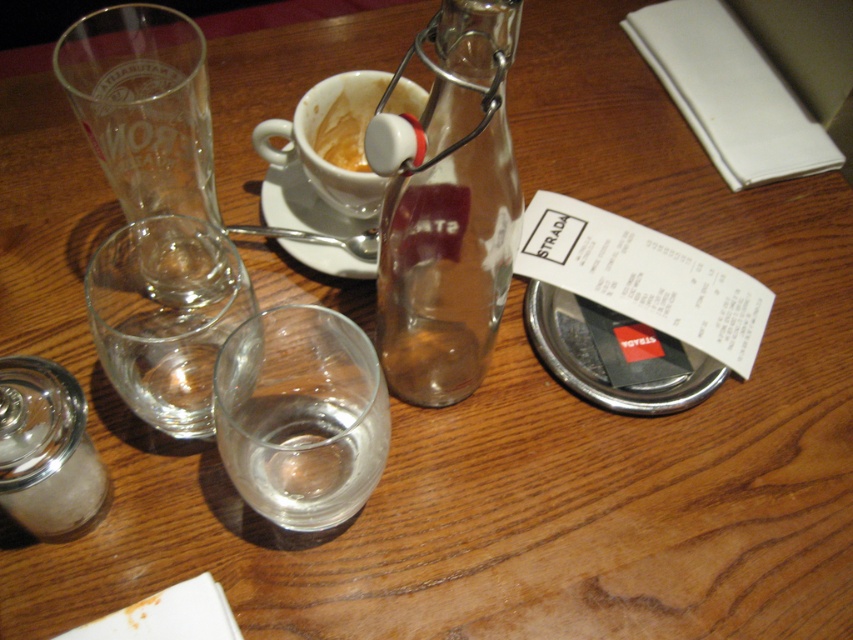
Question: Which object is closer to the camera taking this photo?

Choices:
 (A) white ceramic saucer at upper center
 (B) matte white cup at upper center

Answer: (B)

Question: Which point is closer to the camera taking this photo?

Choices:
 (A) coord(347,266)
 (B) coord(479,144)
 (C) coord(338,132)

Answer: (B)

Question: Which point is closer to the camera?

Choices:
 (A) white ceramic cup at upper center
 (B) white ceramic saucer at upper center

Answer: (A)

Question: Does transparent glass bottle at center come behind matte white cup at upper center?

Choices:
 (A) yes
 (B) no

Answer: (B)

Question: Does white ceramic cup at upper center have a greater width compared to matte white cup at upper center?

Choices:
 (A) yes
 (B) no

Answer: (A)

Question: Can you confirm if white ceramic cup at upper center is positioned above white ceramic saucer at upper center?

Choices:
 (A) no
 (B) yes

Answer: (B)